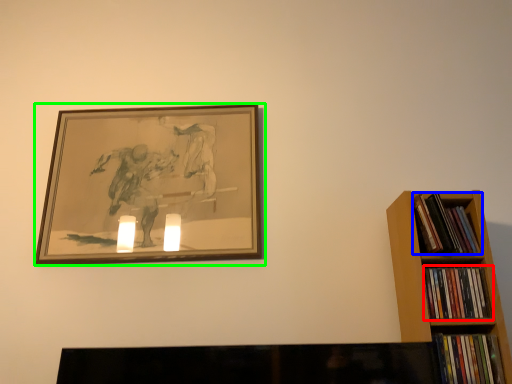
Question: Which is farther away from book (highlighted by a red box)? book (highlighted by a blue box) or picture frame (highlighted by a green box)?

Choices:
 (A) book
 (B) picture frame

Answer: (B)